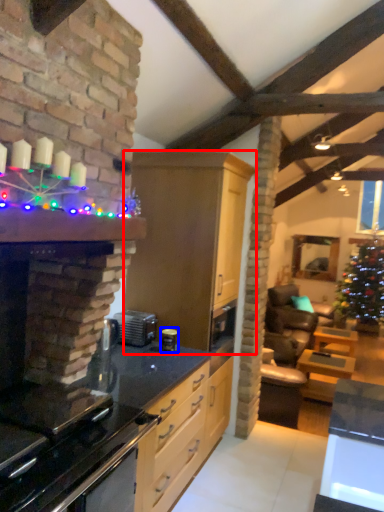
Question: Which point is closer to the camera, cabinetry (highlighted by a red box) or appliance (highlighted by a blue box)?

Choices:
 (A) cabinetry
 (B) appliance

Answer: (A)